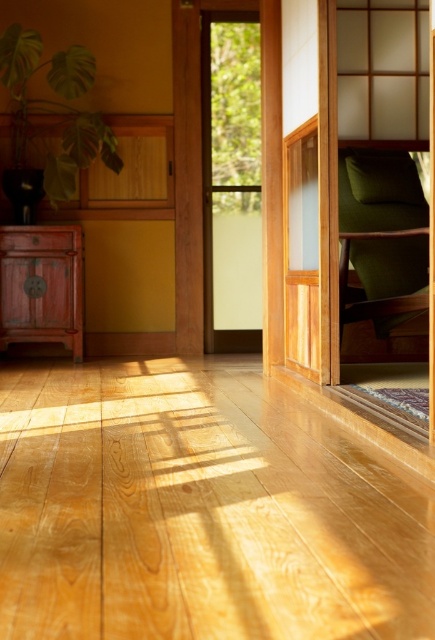
Question: Estimate the real-world distances between objects in this image. Which object is farther from the green matte leafy plant at upper left?

Choices:
 (A) green fabric armchair at upper right
 (B) matte reddish-brown cabinet at left

Answer: (A)

Question: Estimate the real-world distances between objects in this image. Which object is closer to the matte reddish-brown cabinet at left?

Choices:
 (A) green matte leafy plant at upper left
 (B) green fabric armchair at upper right

Answer: (A)

Question: Which point is farther to the camera?

Choices:
 (A) matte reddish-brown cabinet at left
 (B) green fabric armchair at upper right

Answer: (A)

Question: In this image, where is green fabric armchair at upper right located relative to green matte leafy plant at upper left?

Choices:
 (A) above
 (B) below

Answer: (B)

Question: Can you confirm if green fabric armchair at upper right is positioned to the right of matte reddish-brown cabinet at left?

Choices:
 (A) yes
 (B) no

Answer: (A)

Question: Does green fabric armchair at upper right appear under green matte leafy plant at upper left?

Choices:
 (A) no
 (B) yes

Answer: (B)